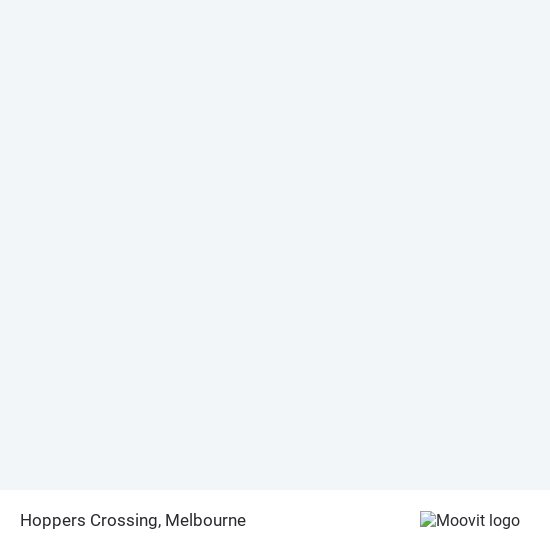
Find the location of a particular element. The image size is (550, 550). broken picture is located at coordinates (429, 522).